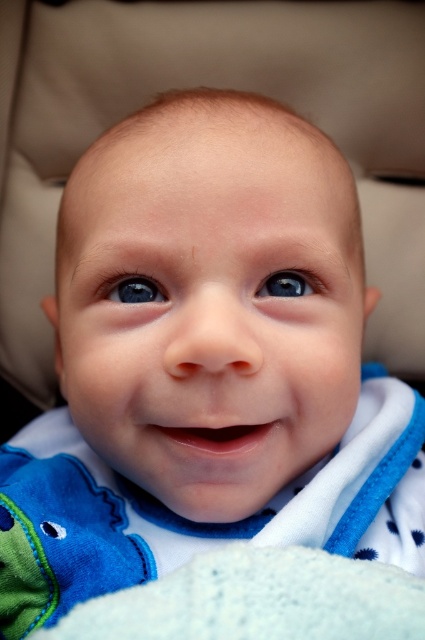
Question: Which point is farther from the camera taking this photo?

Choices:
 (A) (391, 444)
 (B) (278, 273)
 (C) (153, 620)
 (D) (147, 284)

Answer: (A)

Question: Is blue fleece bib at center positioned in front of blue glossy eye at center?

Choices:
 (A) no
 (B) yes

Answer: (B)

Question: Which point is closer to the camera taking this photo?

Choices:
 (A) (399, 400)
 (B) (314, 612)
 (C) (299, 282)

Answer: (B)

Question: Observing the image, what is the correct spatial positioning of blue fleece bib at center in reference to white soft blanket at lower center?

Choices:
 (A) left
 (B) right

Answer: (B)

Question: Does white soft blanket at lower center have a larger size compared to blue glossy eye at upper center?

Choices:
 (A) no
 (B) yes

Answer: (B)

Question: Estimate the real-world distances between objects in this image. Which object is closer to the blue fleece bib at center?

Choices:
 (A) blue glossy eye at upper center
 (B) blue glossy eye at center
 (C) white soft blanket at lower center

Answer: (C)